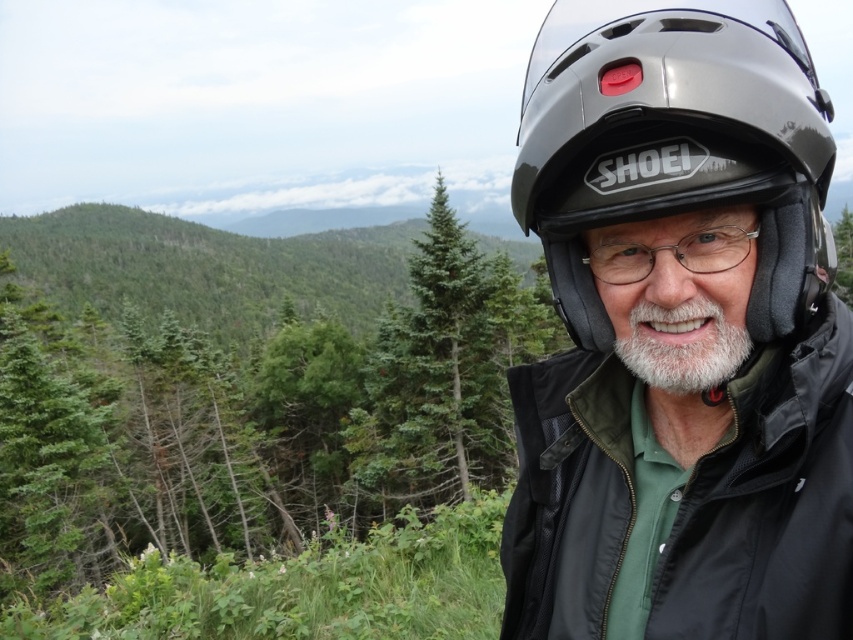
Question: In this image, where is glossy black helmet at upper right located relative to clear plastic glasses at center?

Choices:
 (A) right
 (B) left

Answer: (A)

Question: Is black matte jacket at right wider than glossy black helmet at upper right?

Choices:
 (A) yes
 (B) no

Answer: (B)

Question: Among these points, which one is farthest from the camera?

Choices:
 (A) (604, 280)
 (B) (642, 56)

Answer: (A)

Question: Which point is closer to the camera?

Choices:
 (A) (631, 250)
 (B) (682, 205)

Answer: (B)

Question: Is black matte jacket at right to the right of clear plastic glasses at center from the viewer's perspective?

Choices:
 (A) no
 (B) yes

Answer: (A)

Question: Which of the following is the farthest from the observer?

Choices:
 (A) (688, 531)
 (B) (781, 58)
 (C) (624, 262)

Answer: (A)